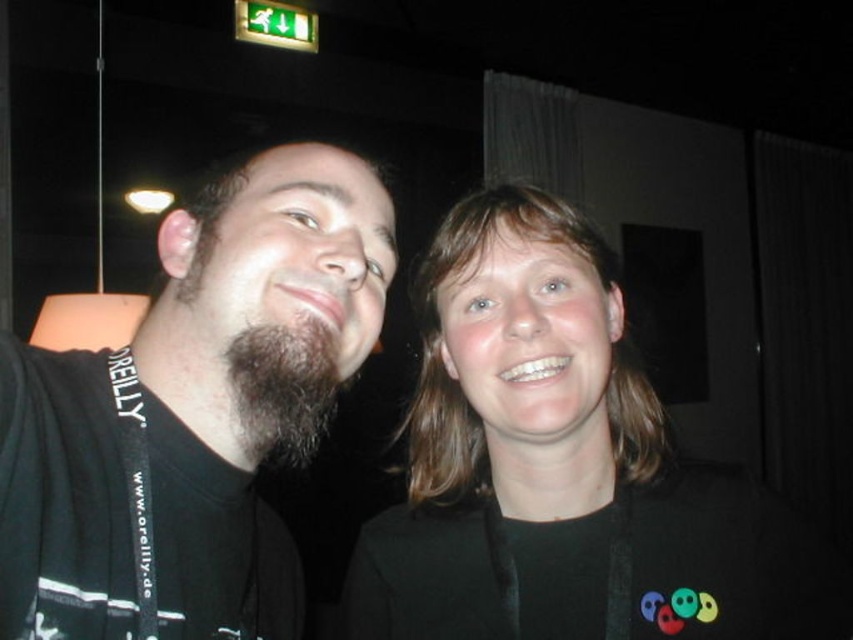
You are at a conference and see two people standing near an exit sign. You notice a black fabric at center and a dark brown fuzzy beard at center. Which object is positioned more to the left?

The dark brown fuzzy beard at center is positioned more to the left because the black fabric at center is to the right of it.